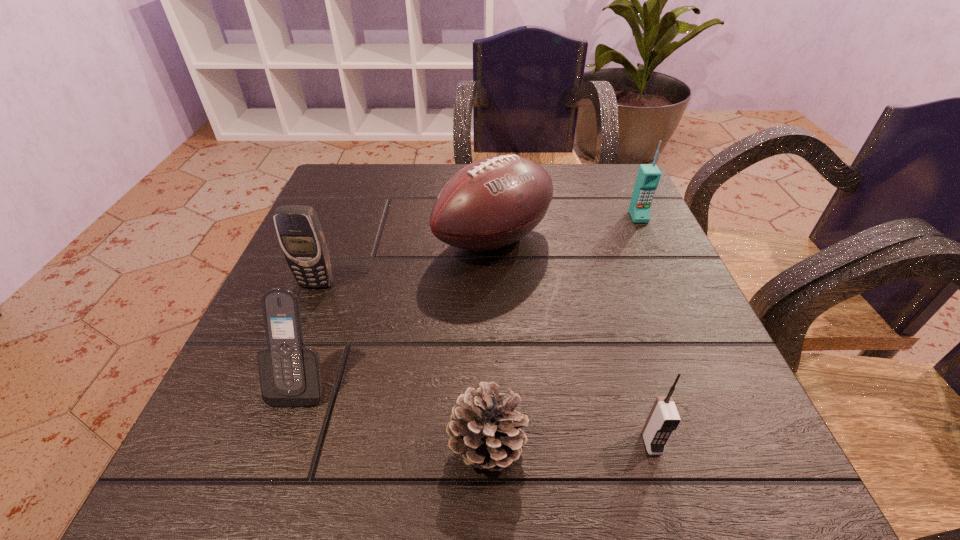
Identify the location of vacant space located 0.240m on the front face of the third farthest object. The image size is (960, 540). (269, 403).

This screenshot has width=960, height=540. What are the coordinates of `vacant point located 0.050m on the front-facing side of the fourth farthest object` in the screenshot? It's located at (281, 440).

This screenshot has height=540, width=960. I want to click on free space located on the right of the shortest object, so tap(763, 446).

You are a GUI agent. You are given a task and a screenshot of the screen. Output one action in this format:
    pyautogui.click(x=<x>, y=<y>)
    Task: Click on the football (American) that is at the far edge
    This screenshot has height=540, width=960.
    Given the screenshot: What is the action you would take?
    pyautogui.click(x=493, y=202)

You are a GUI agent. You are given a task and a screenshot of the screen. Output one action in this format:
    pyautogui.click(x=<x>, y=<y>)
    Task: Click on the cellular telephone that is at the far edge
    This screenshot has height=540, width=960.
    Given the screenshot: What is the action you would take?
    pyautogui.click(x=648, y=177)

This screenshot has width=960, height=540. I want to click on cellular telephone positioned at the near edge, so click(x=663, y=419).

The width and height of the screenshot is (960, 540). Find the location of `pinecone present at the near edge`. pinecone present at the near edge is located at coordinates (484, 428).

Image resolution: width=960 pixels, height=540 pixels. Identify the location of object present at the far right corner. [648, 177].

You are a GUI agent. You are given a task and a screenshot of the screen. Output one action in this format:
    pyautogui.click(x=<x>, y=<y>)
    Task: Click on the object at the near right corner
    
    Given the screenshot: What is the action you would take?
    pyautogui.click(x=663, y=419)

Image resolution: width=960 pixels, height=540 pixels. In order to click on vacant space at the far edge in this screenshot , I will do `click(411, 171)`.